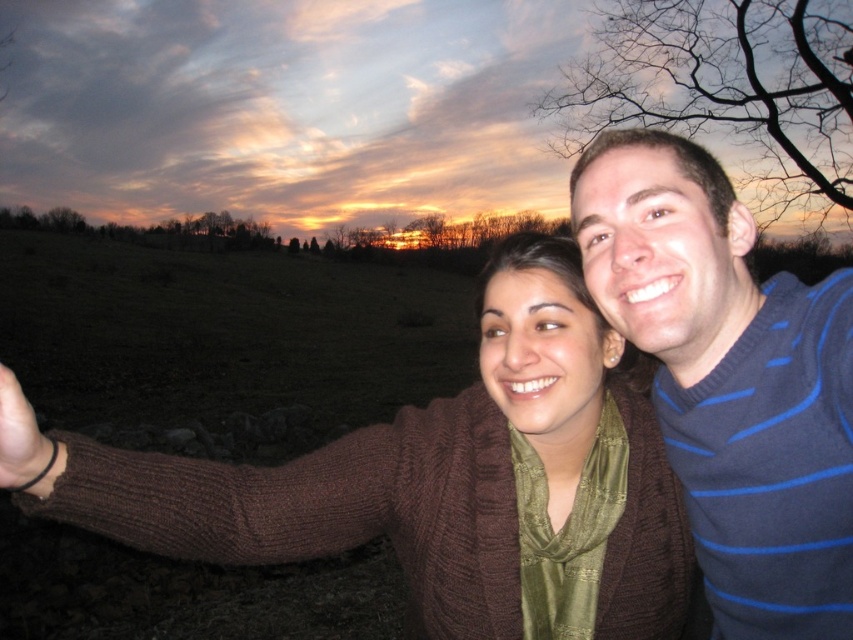
Is point (822, 525) farther from camera compared to point (10, 406)?

Yes, it is behind point (10, 406).

Is point (769, 621) in front of point (35, 420)?

No, (769, 621) is further to viewer.

Identify the location of blue striped sweater at right. This screenshot has width=853, height=640. (730, 380).